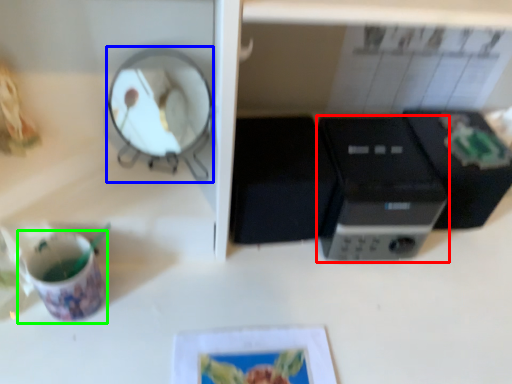
Question: Which is farther away from home appliance (highlighted by a red box)? mirror (highlighted by a blue box) or coffee cup (highlighted by a green box)?

Choices:
 (A) mirror
 (B) coffee cup

Answer: (B)